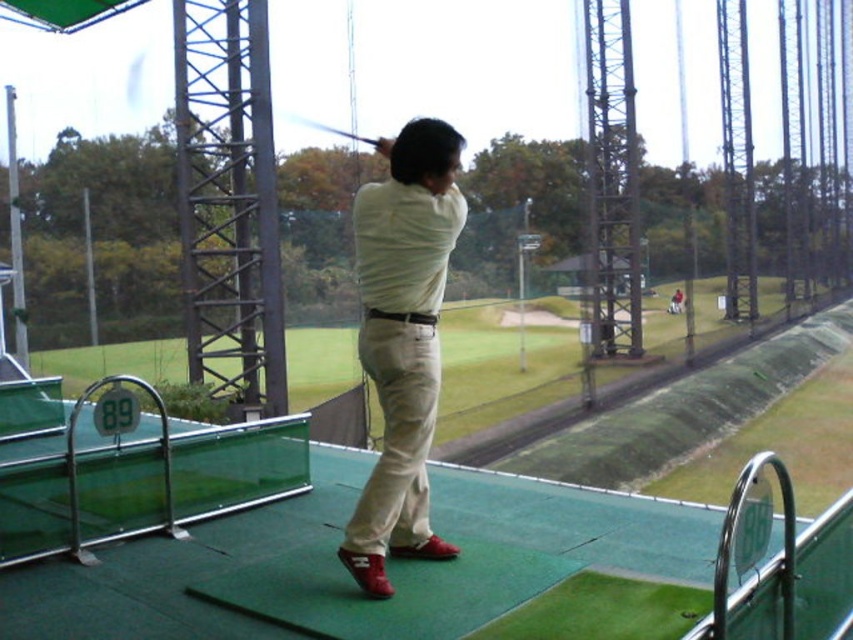
You are a golf instructor observing a student practicing at the indoor driving range. You notice the matte white shirt at center and the shiny black golf club at center. Which object is shorter in height?

The matte white shirt at center has a lesser height compared to the shiny black golf club at center, so the matte white shirt at center is shorter.

In the scene shown: You are a golf instructor observing a student at the indoor driving range. The student is standing on the green rubber mat at center and holding the shiny black golf club at center. Which object is closer to you, the instructor, when you are facing the student?

The green rubber mat at center is closer to the viewer than the shiny black golf club at center, so the mat is closer to you.

You are a golf instructor analyzing a student practicing at an indoor driving range. The student is standing on the green rubber mat at center. To ensure proper alignment, you want to place a target marker exactly 1 meter in front of their current position. Given the mat is at coordinates point 0.891, 0.404, what are the coordinates of the point where you should place the target marker?

The target marker should be placed at coordinates point (344,570) plus 1 meter in the direction the student is facing. However, without knowing the orientation of the student, it is impossible to determine the exact coordinates. Please clarify the direction the student is facing to calculate the precise location.